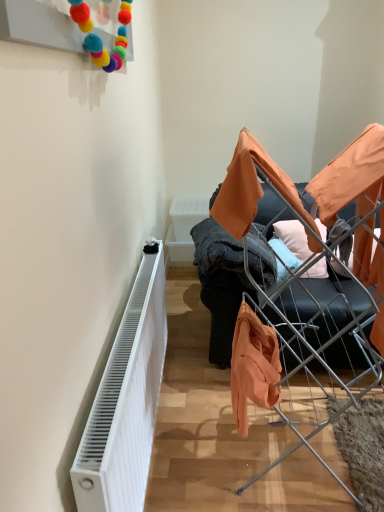
Question: Is soft cotton pillow at center situated inside white ribbed radiator at lower left or outside?

Choices:
 (A) inside
 (B) outside

Answer: (B)

Question: Looking at their shapes, would you say soft cotton pillow at center is wider or thinner than white ribbed radiator at lower left?

Choices:
 (A) thin
 (B) wide

Answer: (B)

Question: Estimate the real-world distances between objects in this image. Which object is farther from the white ribbed radiator at lower left?

Choices:
 (A) orange fabric at center
 (B) orange fabric couch at center
 (C) soft cotton pillow at center

Answer: (C)

Question: Which is farther from the white ribbed radiator at lower left?

Choices:
 (A) orange fabric at center
 (B) soft cotton pillow at center
 (C) orange fabric couch at center

Answer: (B)